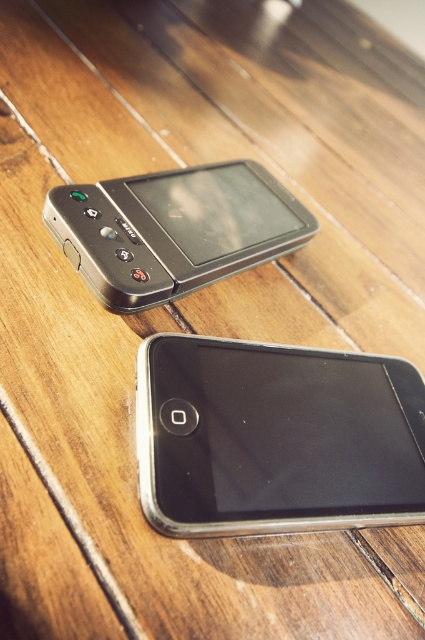
Between point (269, 404) and point (110, 220), which one is positioned behind?

The point (110, 220) is behind.

Based on the photo, between black plastic smartphone at center and matte black phone at upper center, which one is positioned higher?

Positioned higher is matte black phone at upper center.

Identify the location of black plastic smartphone at center. (275, 436).